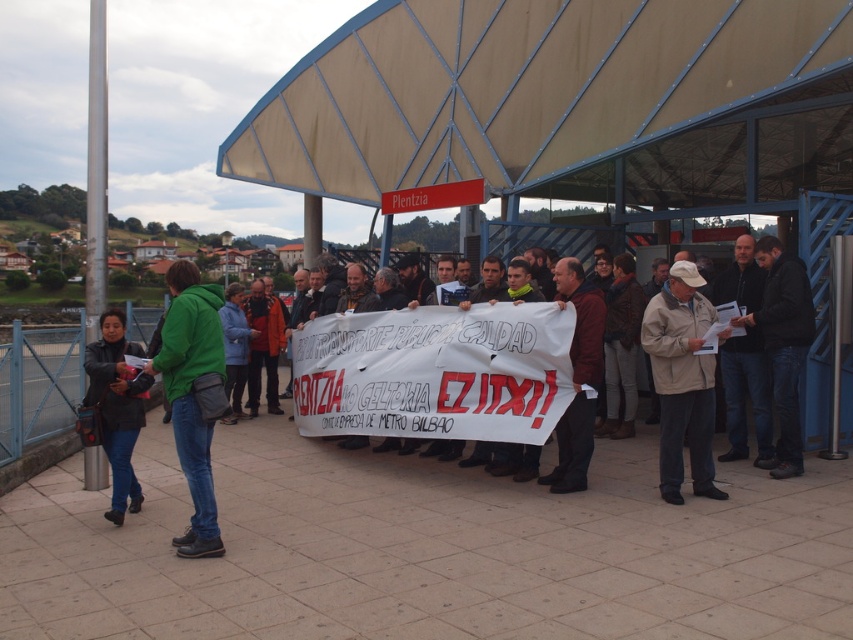
Question: Which of the following is the closest to the observer?

Choices:
 (A) dark blue jeans at center
 (B) green matte jacket at left
 (C) black leather jacket at lower left

Answer: (B)

Question: Among these points, which one is farthest from the camera?

Choices:
 (A) (173, 314)
 (B) (720, 493)
 (C) (119, 435)
 (D) (785, 346)

Answer: (D)

Question: Which point is farther to the camera?

Choices:
 (A) (694, 467)
 (B) (799, 284)
 (C) (206, 467)
 (D) (416, 316)

Answer: (D)

Question: Does beige fabric jacket at center come behind black leather jacket at lower left?

Choices:
 (A) no
 (B) yes

Answer: (B)

Question: Is dark blue jeans at center closer to camera compared to black leather jacket at lower left?

Choices:
 (A) no
 (B) yes

Answer: (A)

Question: Observing the image, what is the correct spatial positioning of green matte jacket at left in reference to dark blue jeans at center?

Choices:
 (A) below
 (B) above

Answer: (A)